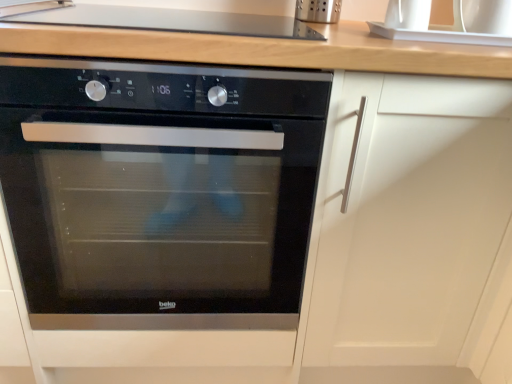
Question: In terms of height, does black glass oven at center look taller or shorter compared to white glossy sink at upper right?

Choices:
 (A) short
 (B) tall

Answer: (B)

Question: Considering their positions, is black glass oven at center located in front of or behind white glossy sink at upper right?

Choices:
 (A) behind
 (B) front

Answer: (B)

Question: Which is nearer to the smooth glass cooktop at upper center?

Choices:
 (A) black glass oven at center
 (B) white glossy sink at upper right

Answer: (B)

Question: Which is farther from the white glossy sink at upper right?

Choices:
 (A) smooth glass cooktop at upper center
 (B) black glass oven at center

Answer: (B)